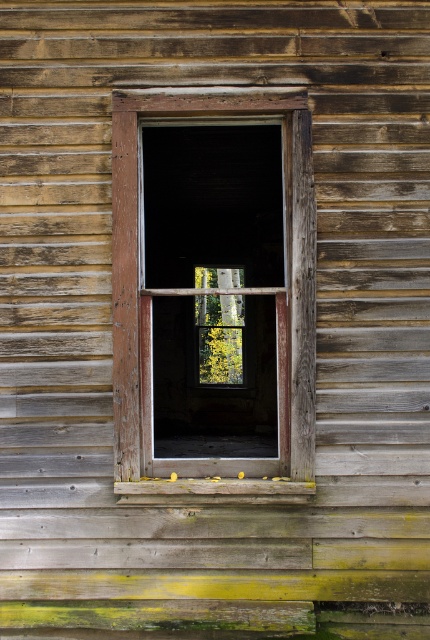
Can you confirm if weathered wood window frame at center is positioned to the left of weathered wood at lower center?

Yes, weathered wood window frame at center is to the left of weathered wood at lower center.

Does weathered wood window frame at center have a larger size compared to weathered wood at lower center?

Yes.

Locate an element on the screen. This screenshot has height=640, width=430. weathered wood window frame at center is located at coordinates (212, 292).